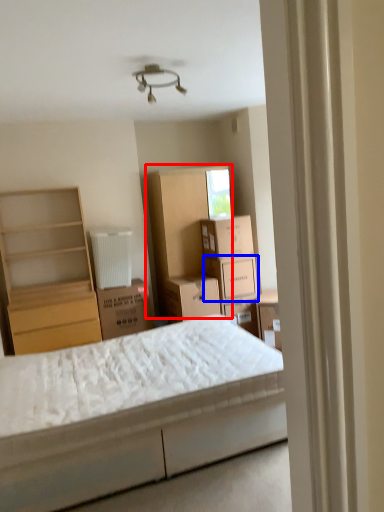
Question: Which object is closer to the camera taking this photo, cabinet (highlighted by a red box) or cardboard box (highlighted by a blue box)?

Choices:
 (A) cabinet
 (B) cardboard box

Answer: (B)